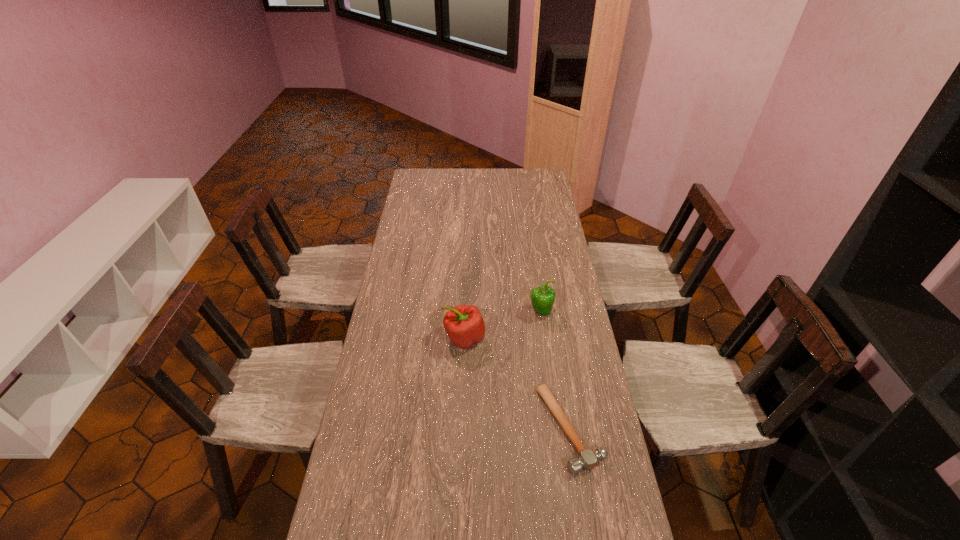
I want to click on the farther bell pepper, so [542, 298].

The width and height of the screenshot is (960, 540). I want to click on the right bell pepper, so click(x=542, y=298).

Locate an element on the screen. This screenshot has width=960, height=540. the left bell pepper is located at coordinates (464, 324).

I want to click on the second nearest object, so click(464, 324).

This screenshot has width=960, height=540. Identify the location of hammer. (588, 459).

Find the location of a particular element. Image resolution: width=960 pixels, height=540 pixels. the shortest object is located at coordinates (588, 459).

You are a GUI agent. You are given a task and a screenshot of the screen. Output one action in this format:
    pyautogui.click(x=<x>, y=<y>)
    Task: Click on the free space located 0.250m on the front of the farthest object
    The width and height of the screenshot is (960, 540).
    Given the screenshot: What is the action you would take?
    pyautogui.click(x=550, y=376)

The image size is (960, 540). Identify the location of vacant space located on the back of the leftmost object. (466, 302).

Identify the location of free space located 0.340m on the left of the nearest object. The image size is (960, 540). (429, 429).

The height and width of the screenshot is (540, 960). I want to click on bell pepper located in the right edge section of the desktop, so click(x=542, y=298).